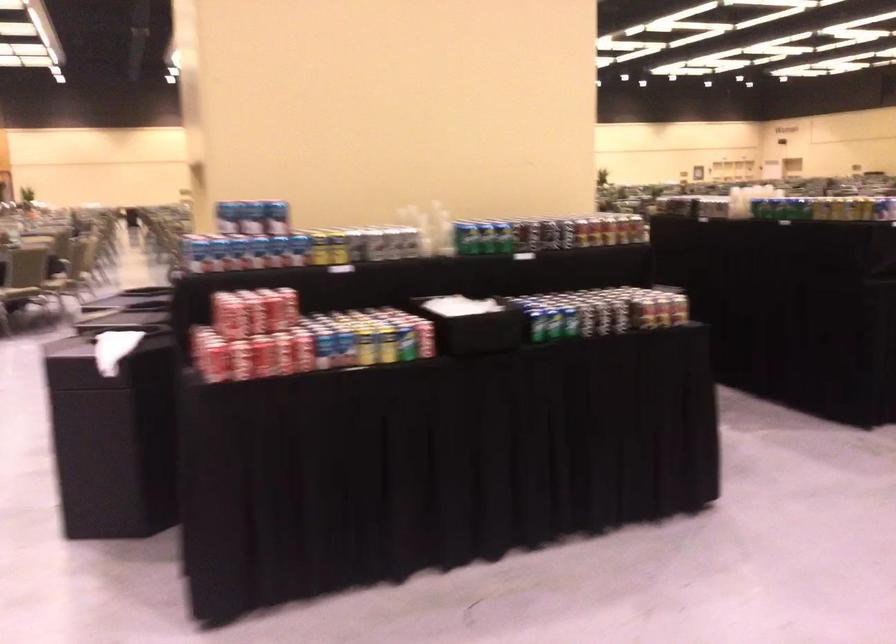
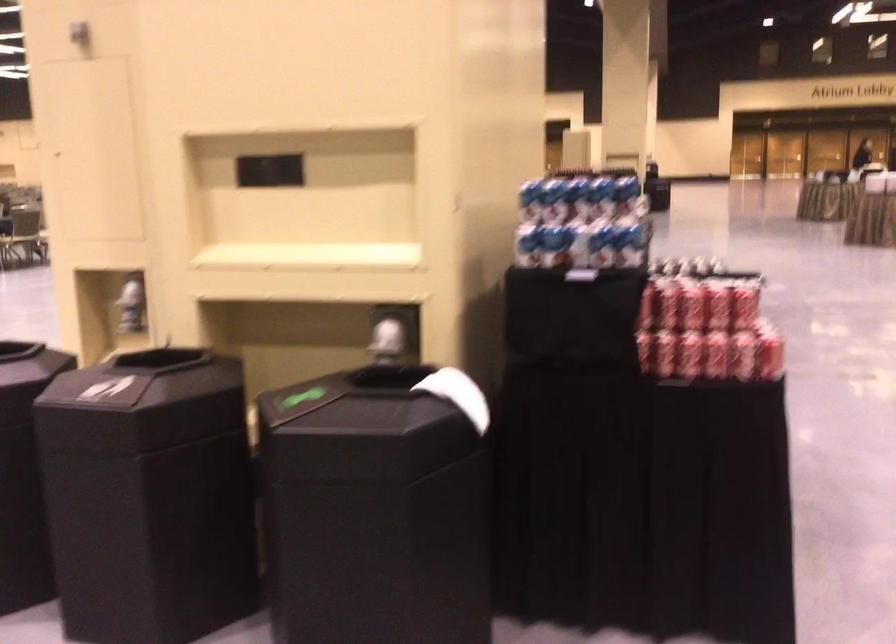
The point at [191,252] is marked in the first image. Where is the corresponding point in the second image?

(600, 245)